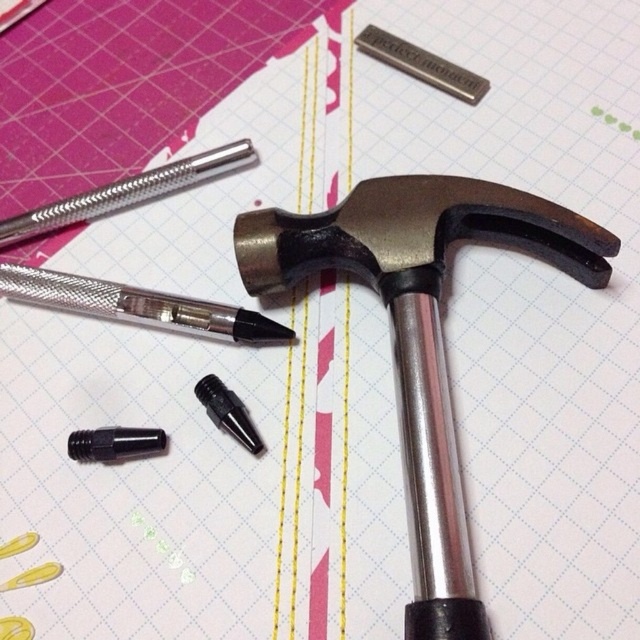
Is point (253, 152) farther from viewer compared to point (216, 376)?

That is True.

The image size is (640, 640). Identify the location of metallic textured pen at upper left. (125, 192).

Is polished metal hammer at center thinner than metallic silver pen at upper left?

No, polished metal hammer at center is not thinner than metallic silver pen at upper left.

Looking at this image, measure the distance between polished metal hammer at center and camera.

polished metal hammer at center is 3.89 feet away from camera.

Does point (424, 572) come behind point (83, 276)?

No, (424, 572) is in front of (83, 276).

Where is `polished metal hammer at center`? The image size is (640, 640). polished metal hammer at center is located at coordinates (420, 333).

Does metallic silver pen at upper left lie behind black plastic screwdriver at lower left?

Yes, metallic silver pen at upper left is further from the viewer.

Can you confirm if metallic silver pen at upper left is shorter than black plastic screwdriver at lower left?

No.

Image resolution: width=640 pixels, height=640 pixels. In order to click on metallic silver pen at upper left in this screenshot , I will do `click(138, 305)`.